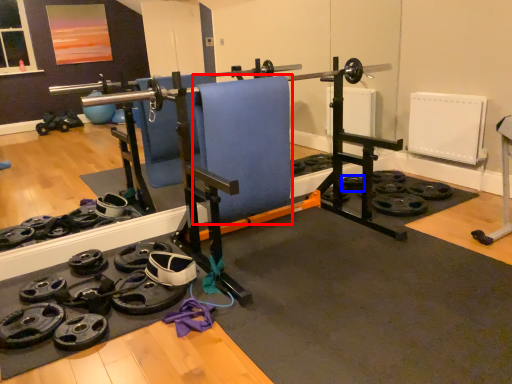
Question: Which of the following is the closest to the observer, swivel chair (highlighted by a red box) or wheel (highlighted by a blue box)?

Choices:
 (A) swivel chair
 (B) wheel

Answer: (A)